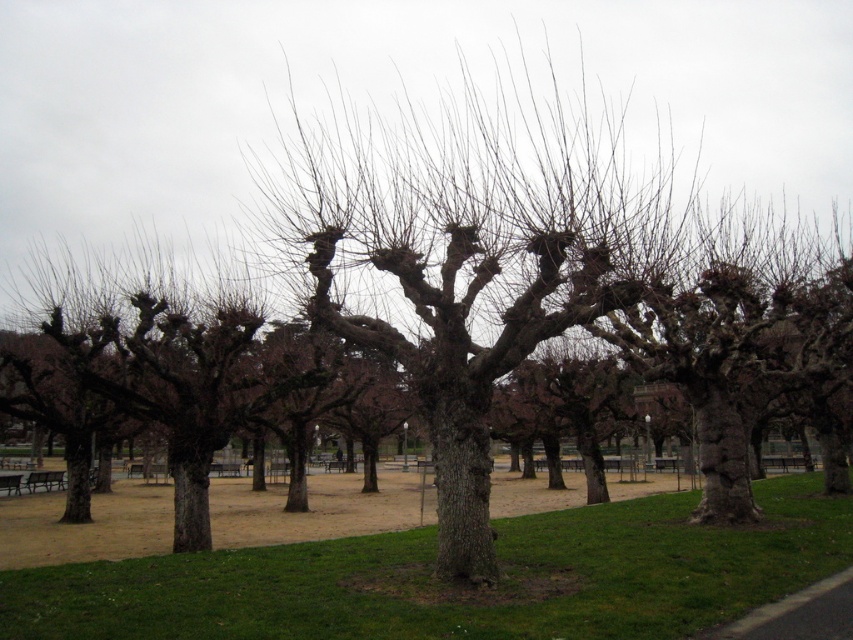
Question: Which object is farther from the camera taking this photo?

Choices:
 (A) green grass at lower center
 (B) bark textured tree at center

Answer: (B)

Question: Among these objects, which one is farthest from the camera?

Choices:
 (A) bark textured tree at center
 (B) green grass at lower center

Answer: (A)

Question: Does bark textured tree at center have a lesser width compared to green grass at lower center?

Choices:
 (A) no
 (B) yes

Answer: (A)

Question: Is bark textured tree at center to the right of green grass at lower center from the viewer's perspective?

Choices:
 (A) yes
 (B) no

Answer: (B)

Question: Which of the following is the farthest from the observer?

Choices:
 (A) (613, 253)
 (B) (393, 589)

Answer: (A)

Question: Does bark textured tree at center have a lesser width compared to green grass at lower center?

Choices:
 (A) yes
 (B) no

Answer: (B)